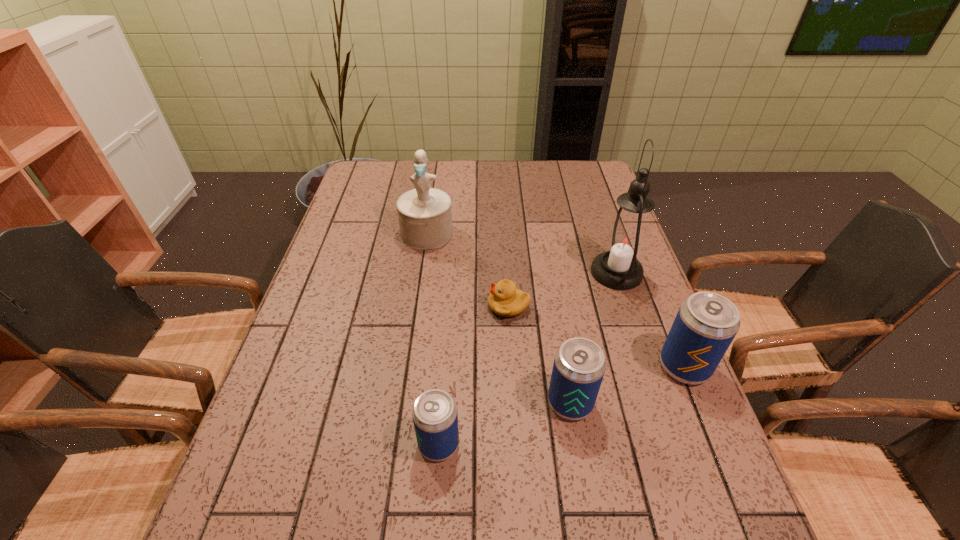
Locate an element on the screen. The image size is (960, 540). the fifth tallest object is located at coordinates (434, 413).

Image resolution: width=960 pixels, height=540 pixels. What are the coordinates of `the leftmost beer can` in the screenshot? It's located at (434, 413).

Locate an element on the screen. This screenshot has height=540, width=960. the second beer can from left to right is located at coordinates (579, 365).

You are a GUI agent. You are given a task and a screenshot of the screen. Output one action in this format:
    pyautogui.click(x=<x>, y=<y>)
    Task: Click on the fourth object from left to right
    
    Given the screenshot: What is the action you would take?
    pyautogui.click(x=579, y=365)

The image size is (960, 540). What are the coordinates of `the rightmost beer can` in the screenshot? It's located at (706, 323).

The width and height of the screenshot is (960, 540). I want to click on the second tallest object, so click(x=425, y=218).

Find the location of a particular element. This screenshot has width=960, height=540. figurine is located at coordinates (425, 218).

The image size is (960, 540). Identify the location of duckling. (505, 300).

The height and width of the screenshot is (540, 960). Find the location of `the shortest object`. the shortest object is located at coordinates (505, 300).

Where is `the tallest object`? The width and height of the screenshot is (960, 540). the tallest object is located at coordinates (625, 241).